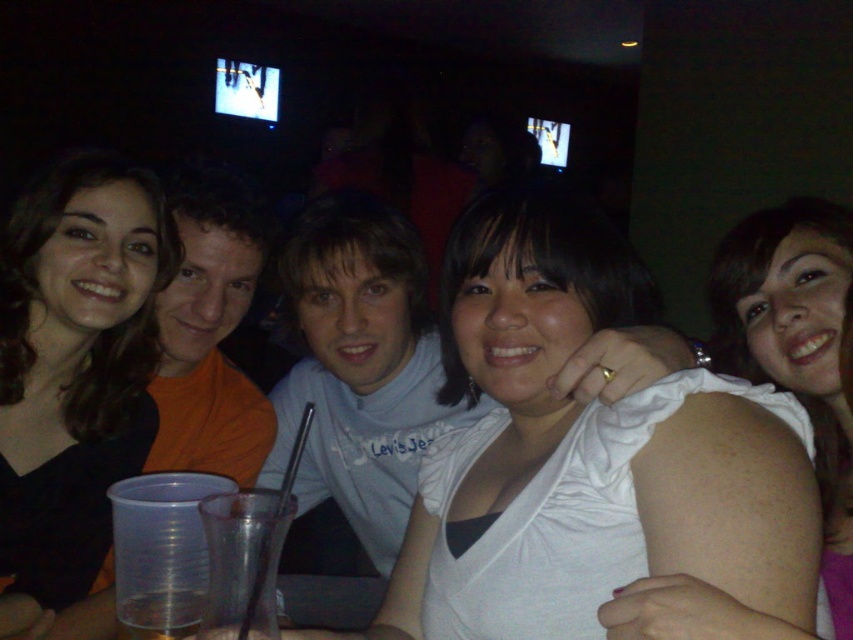
Based on the scene description, where is the white cotton shirt at center located in the image?

The white cotton shirt at center is located at point [360,369].

You are a photographer adjusting the camera settings to ensure all subjects are in focus. Given the smooth black hair at left and white matte shoulder at upper right, which object should you prioritize focusing on first to account for their sizes?

The smooth black hair at left should be prioritized for focusing first since it is wider than the white matte shoulder at upper right, ensuring the larger subject is in focus before adjusting for the smaller one.

From the picture: You are a photographer trying to capture a closeup of the white cotton shirt at center and the white matte shoulder at upper right. Which object would require you to zoom in more to fill the frame?

The white cotton shirt at center is bigger than the white matte shoulder at upper right, so you would need to zoom in less to fill the frame for the white cotton shirt at center and zoom in more for the white matte shoulder at upper right.